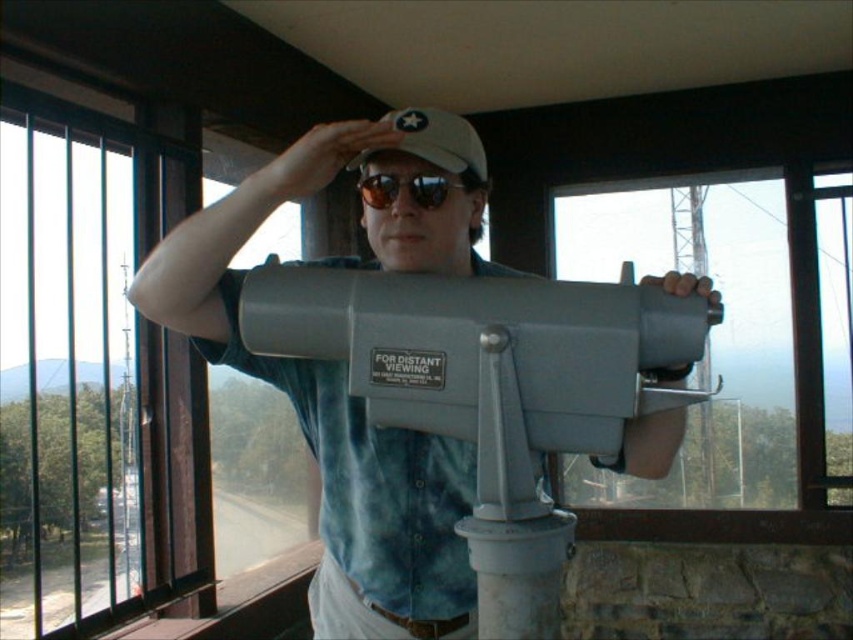
Question: Is clear glass window at left positioned before white matte baseball hat at center?

Choices:
 (A) yes
 (B) no

Answer: (B)

Question: Which point is farther to the camera?

Choices:
 (A) clear glass window at left
 (B) sunglasses at center
 (C) white matte baseball hat at center
 (D) matte gray telescope at center

Answer: (A)

Question: Which point is farther to the camera?

Choices:
 (A) (38, 589)
 (B) (448, 186)
 (C) (276, 164)
 (D) (421, 157)

Answer: (A)

Question: In this image, where is matte gray telescope at center located relative to white matte baseball hat at center?

Choices:
 (A) below
 (B) above

Answer: (A)

Question: Can you confirm if matte gray telescope at center is positioned below white matte baseball hat at center?

Choices:
 (A) no
 (B) yes

Answer: (B)

Question: Which point appears farthest from the camera in this image?

Choices:
 (A) (158, 282)
 (B) (408, 193)

Answer: (B)